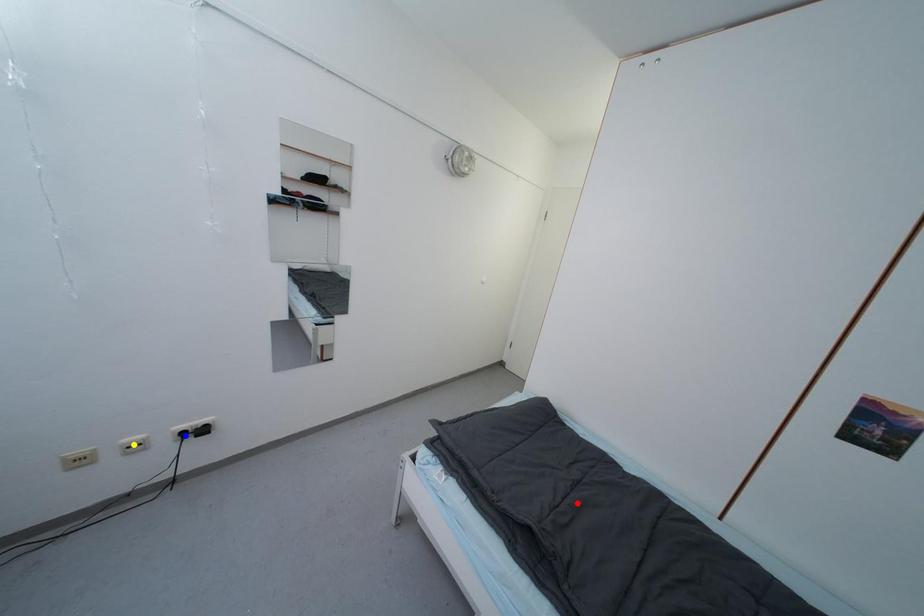
Order these from nearest to farthest:
yellow point
blue point
red point

yellow point
red point
blue point